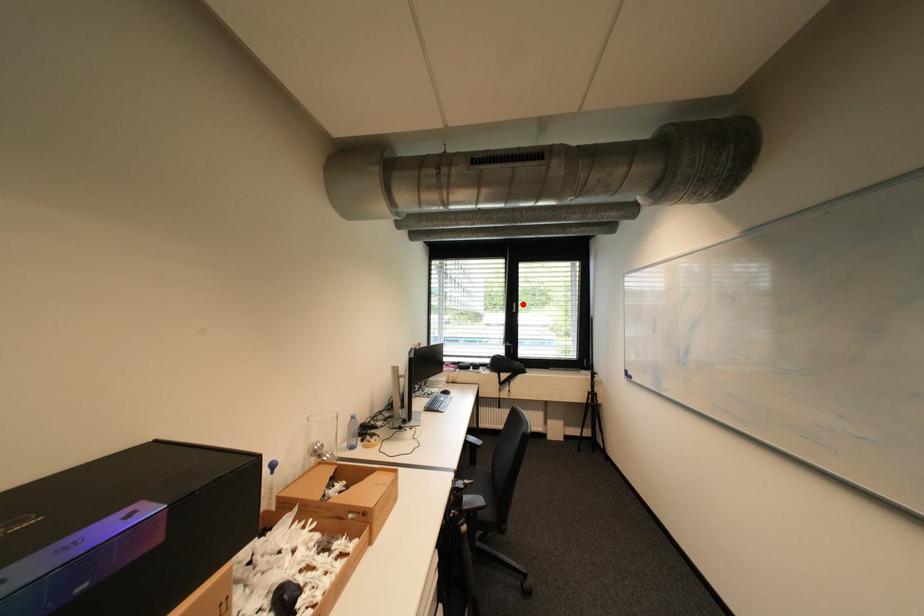
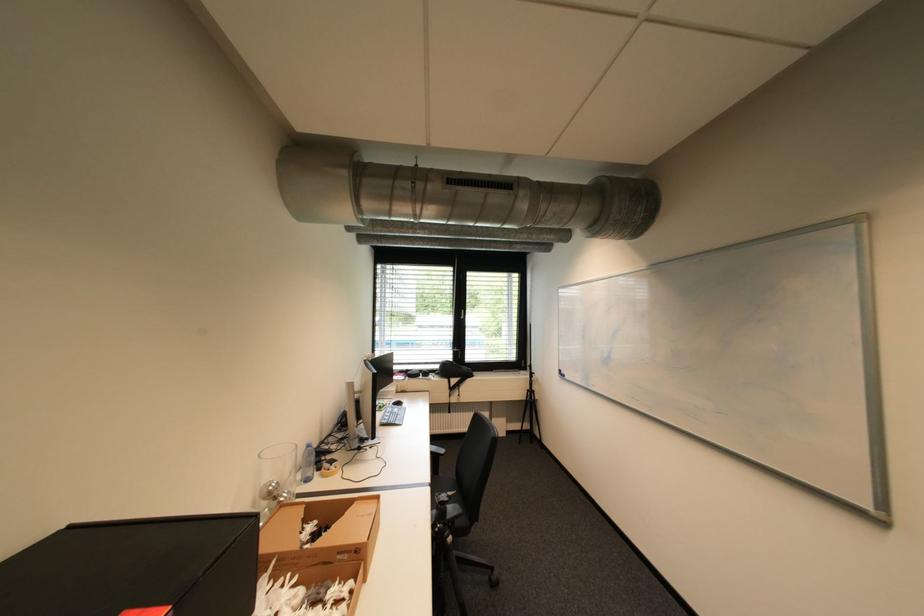
In the second image, find the point that corresponds to the highlighted location in the first image.

(470, 312)